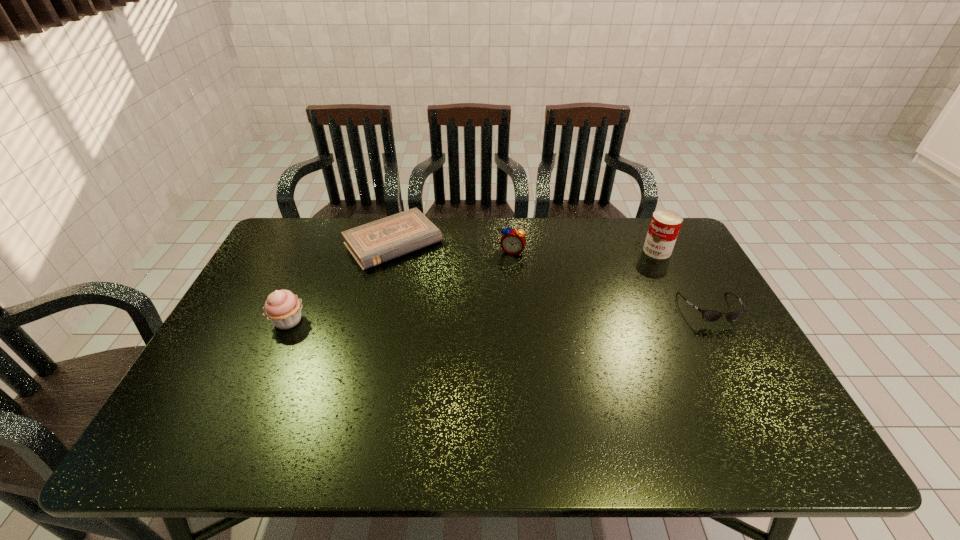
Where is `the leftmost object`? the leftmost object is located at coordinates (283, 308).

Identify the location of sunglasses. The width and height of the screenshot is (960, 540). (708, 315).

What are the coordinates of `can` in the screenshot? It's located at (665, 224).

In order to click on the third object from left to right in this screenshot , I will do `click(513, 241)`.

Find the location of `the shortest object`. the shortest object is located at coordinates (371, 244).

Find the location of a particular element. Image resolution: width=960 pixels, height=540 pixels. the fourth object from right to left is located at coordinates (371, 244).

Identify the location of vacant point located 0.240m on the back of the cupcake. (318, 255).

Locate an element on the screen. The width and height of the screenshot is (960, 540). vacant region located 0.090m on the front-facing side of the fourth tallest object is located at coordinates (733, 353).

Image resolution: width=960 pixels, height=540 pixels. Find the location of `free space located 0.100m on the front label of the tallest object`. free space located 0.100m on the front label of the tallest object is located at coordinates (630, 268).

At what (x,y) coordinates should I click in order to perform the action: click on vacant space located 0.060m on the front label of the tallest object. Please return your answer as a coordinate pair (x, y). Looking at the image, I should click on coord(637,264).